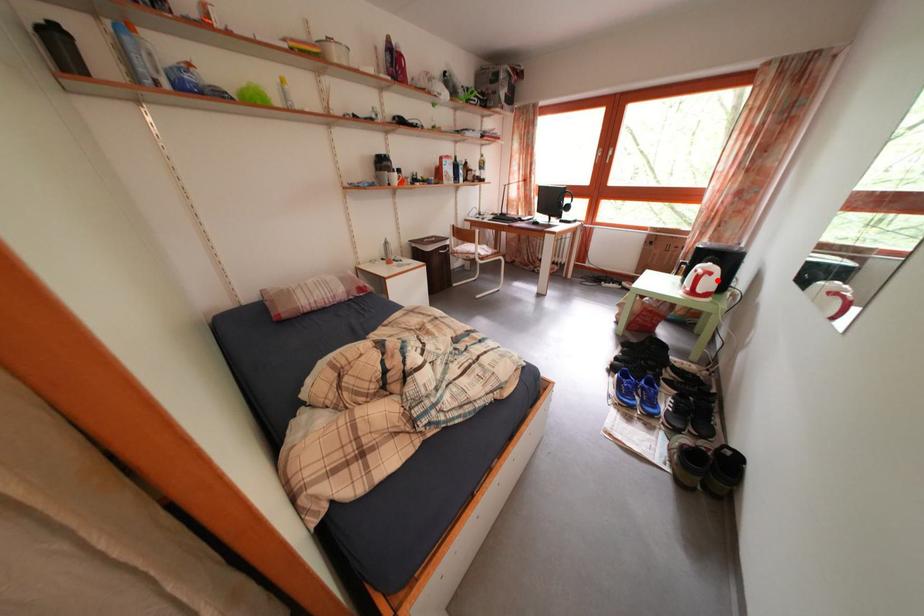
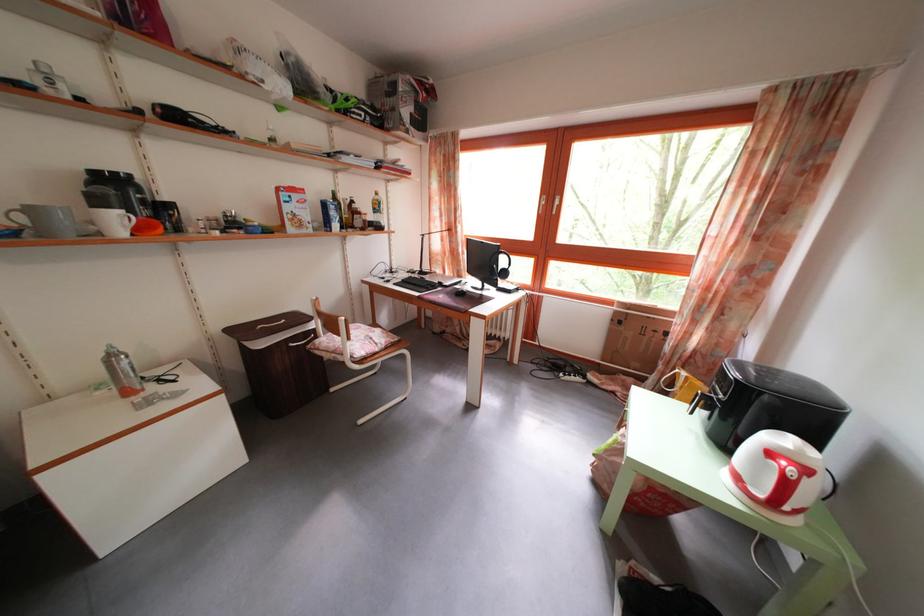
In the second image, find the point that corresponds to the highlighted location in the first image.

(812, 477)